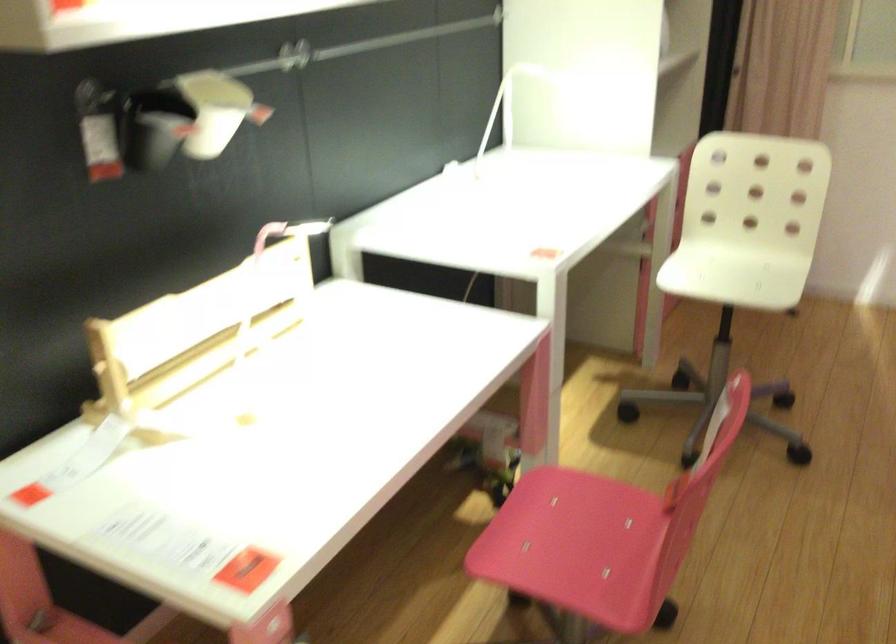
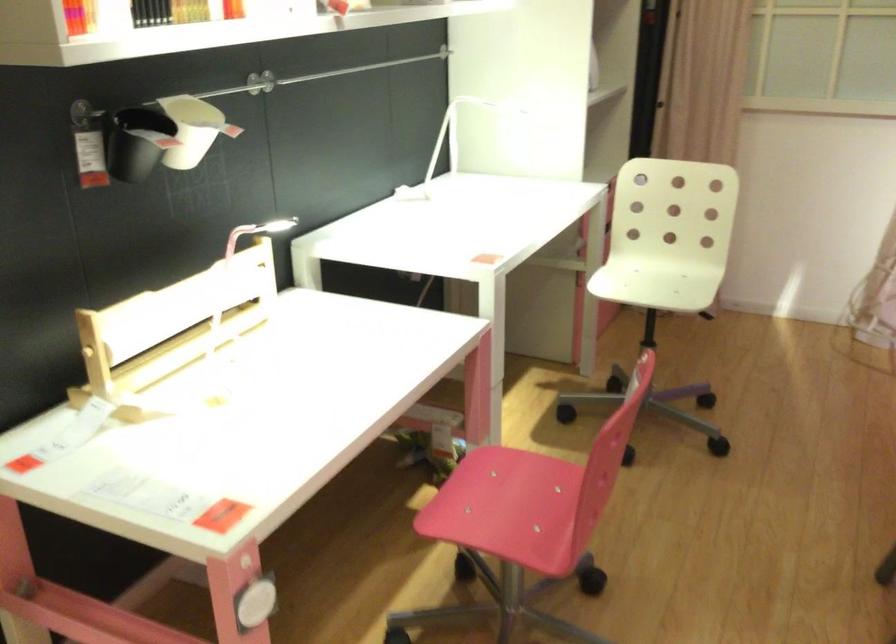
Question: How did the camera likely rotate?

Choices:
 (A) Left
 (B) Right
 (C) Up
 (D) Down

Answer: (B)